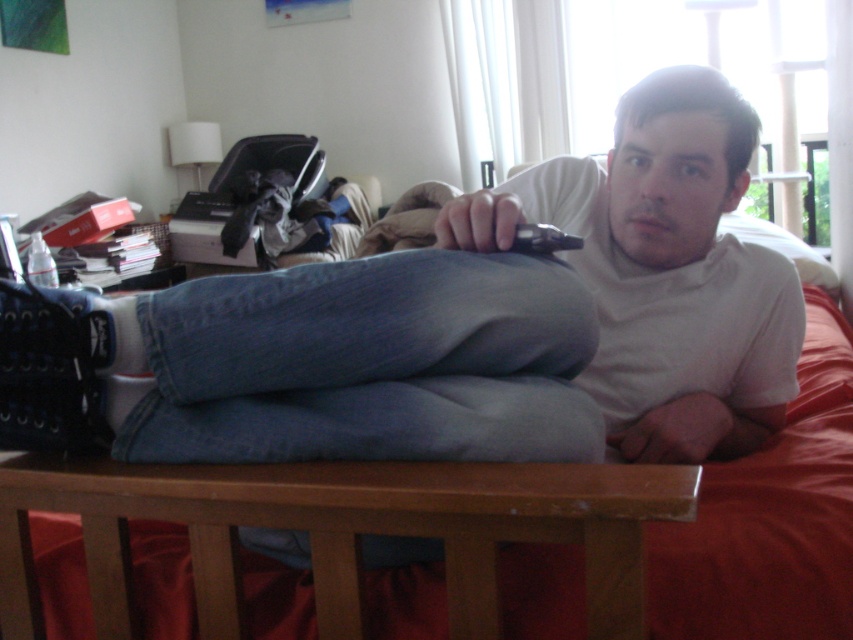
How distant is denim jeans at center from black plastic remote at upper center?

The distance of denim jeans at center from black plastic remote at upper center is 10.26 inches.

The image size is (853, 640). Identify the location of denim jeans at center. (488, 323).

Who is positioned more to the right, denim jeans at center or denim bed at center?

denim bed at center

Is denim jeans at center to the left of denim bed at center from the viewer's perspective?

Yes, denim jeans at center is to the left of denim bed at center.

Image resolution: width=853 pixels, height=640 pixels. What do you see at coordinates (488, 323) in the screenshot? I see `denim jeans at center` at bounding box center [488, 323].

Where is `denim jeans at center`? denim jeans at center is located at coordinates (488, 323).

Who is positioned more to the right, denim bed at center or black plastic remote at upper center?

denim bed at center is more to the right.

Can you confirm if denim bed at center is taller than black plastic remote at upper center?

Indeed, denim bed at center has a greater height compared to black plastic remote at upper center.

Does point (523, 561) lie behind point (537, 248)?

Yes, it is behind point (537, 248).

Locate an element on the screen. This screenshot has height=640, width=853. denim bed at center is located at coordinates (770, 516).